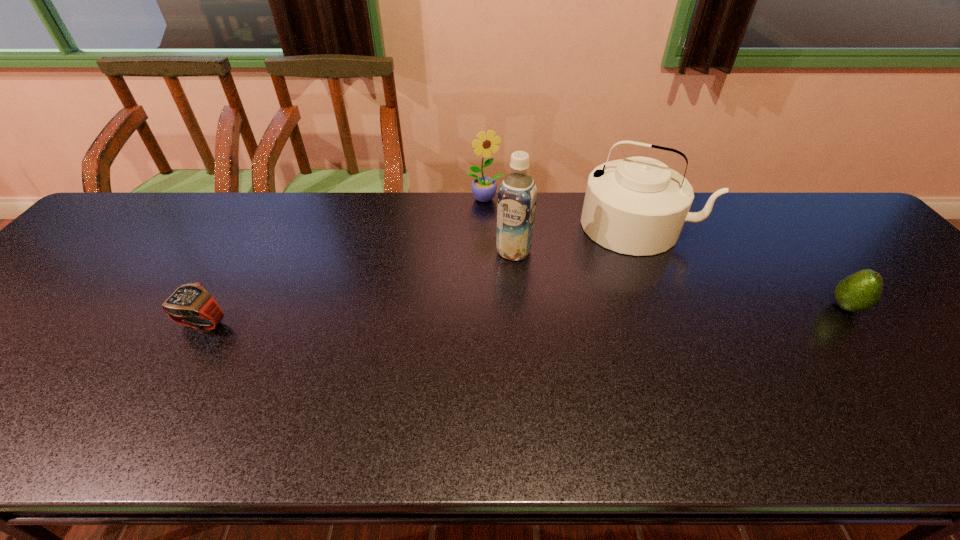
At what (x,y) coordinates should I click in order to perform the action: click on free space on the desktop that is between the watch and the rightmost object and is positioned on the front-facing side of the sunflower. Please return your answer as a coordinate pair (x, y). This screenshot has height=540, width=960. Looking at the image, I should click on (540, 314).

Identify the location of vacant spot on the desktop that is between the watch and the rightmost object and is positioned on the label of the soya milk. click(478, 316).

You are a GUI agent. You are given a task and a screenshot of the screen. Output one action in this format:
    pyautogui.click(x=<x>, y=<y>)
    Task: Click on the free space on the desktop that is between the watch and the rightmost object and is positioned on the spout of the second object from right to left
    Image resolution: width=960 pixels, height=540 pixels.
    Given the screenshot: What is the action you would take?
    pyautogui.click(x=612, y=313)